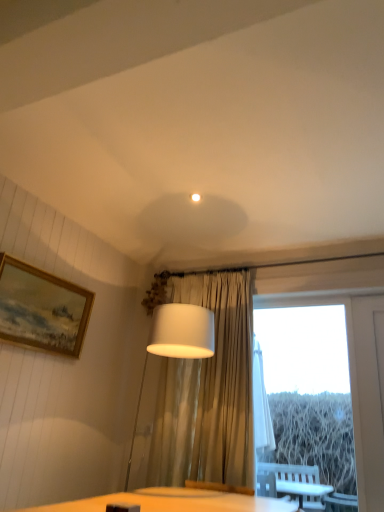
Question: Is point (326, 347) positioned closer to the camera than point (165, 315)?

Choices:
 (A) closer
 (B) farther

Answer: (B)

Question: Is transparent glass window at center situated inside white fabric lampshade at center or outside?

Choices:
 (A) inside
 (B) outside

Answer: (B)

Question: Estimate the real-world distances between objects in this image. Which object is closer to the gold-framed painting at upper left?

Choices:
 (A) white fabric lampshade at center
 (B) transparent glass window at center

Answer: (A)

Question: Which object is positioned farthest from the white fabric lampshade at center?

Choices:
 (A) gold-framed painting at upper left
 (B) transparent glass window at center

Answer: (B)